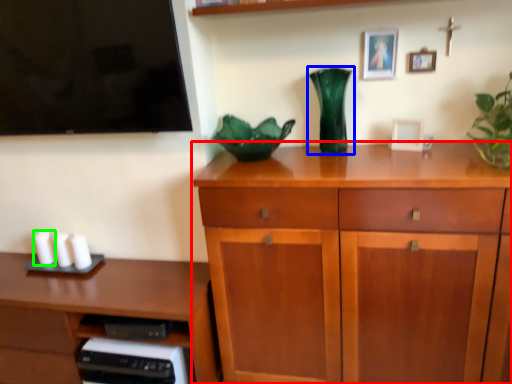
Question: Which object is the closest to the chest of drawers (highlighted by a red box)? Choose among these: vase (highlighted by a blue box) or candle (highlighted by a green box).

Choices:
 (A) vase
 (B) candle

Answer: (A)